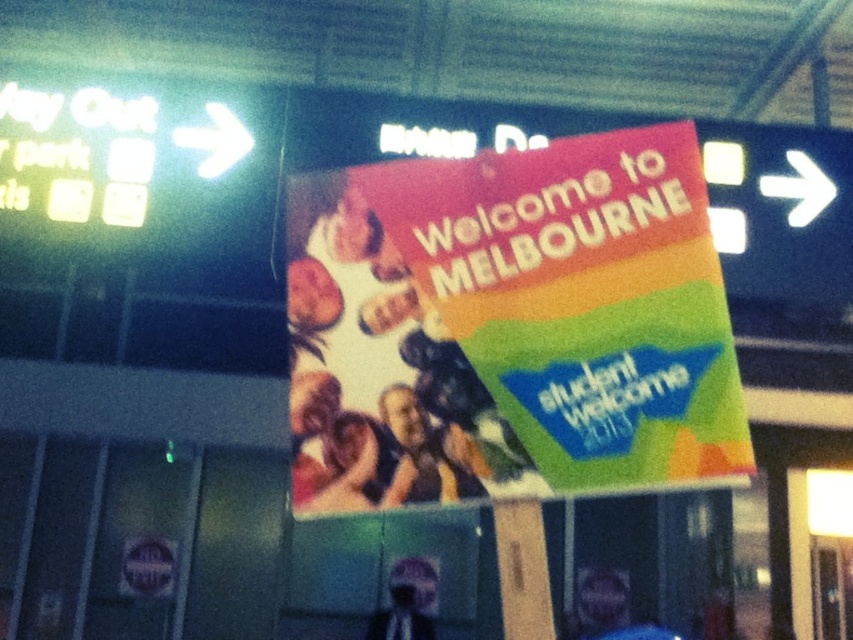
You are at an airport and need to find the nearest parking lot. You see a matte plastic poster at center and a silvery metallic helmet at center. Which object can help you find the parking lot?

The matte plastic poster at center can help you find the nearest parking lot because it has a smaller size compared to the silvery metallic helmet at center, making it easier to read the directions on the poster.

You are standing in a busy airport terminal and see the matte plastic poster at center and the silvery metallic helmet at center. You need to place a small potted plant between them. Is there enough space?

The distance between the matte plastic poster at center and the silvery metallic helmet at center is 13.36 feet, so there is plenty of space to place a small potted plant between them.